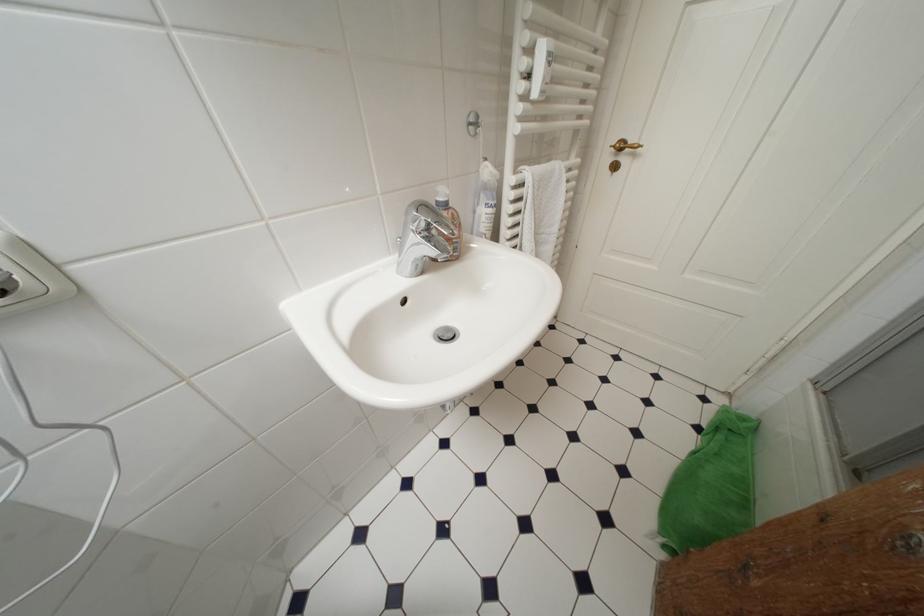
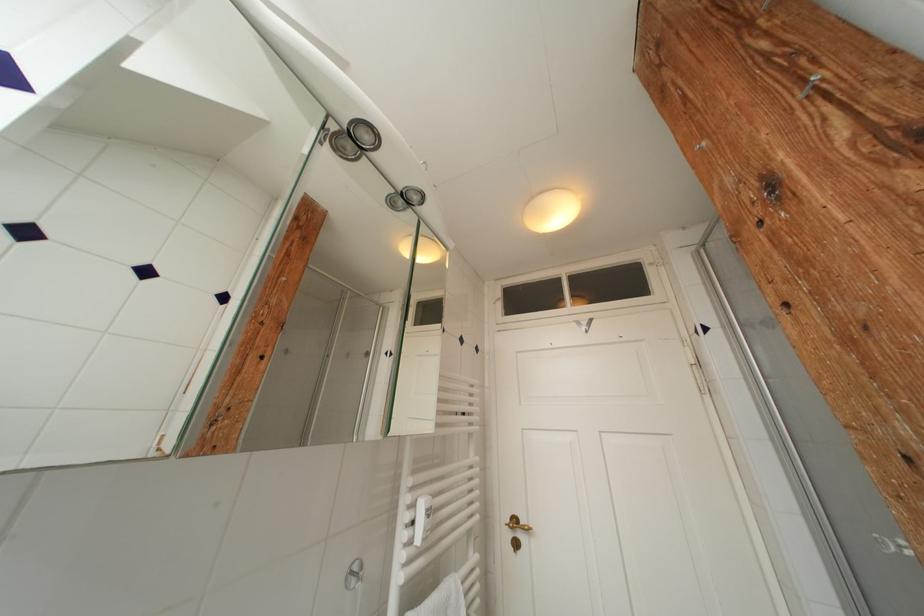
The first image is from the beginning of the video and the second image is from the end. How did the camera likely rotate when shooting the video?

The camera's rotation is toward right-up.